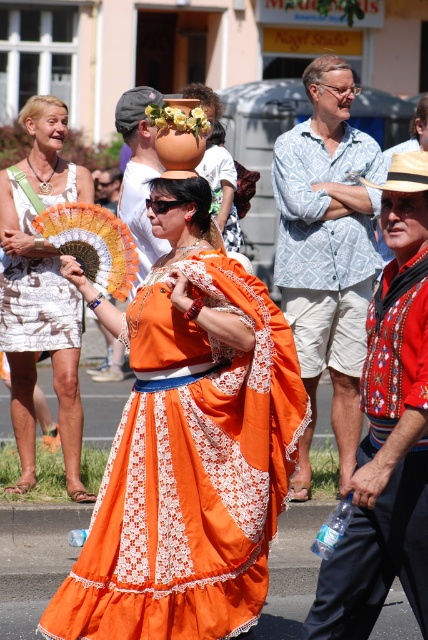
You are attending a cultural event and notice two people wearing the orange fabric dress at center and the light blue patterned shirt at center. Which one is positioned lower in the image?

The orange fabric dress at center is located below the light blue patterned shirt at center, so the orange fabric dress at center is positioned lower in the image.

You are a photographer at the event and want to capture the orange fabric dress at center and the matte white hat at center in a single photo. Which object should you focus on first to ensure both are in the frame?

The orange fabric dress at center is in front of the matte white hat at center, so you should focus on the matte white hat at center first to ensure both are in the frame.

You are a photographer at the event and want to capture both the embroidered cotton robe at center and the white lace dress at left in a single photo. Since you can only focus on one subject, which one will appear clearer in the photo?

The embroidered cotton robe at center will appear clearer in the photo because it is closer to the camera, being in front of the white lace dress at left.